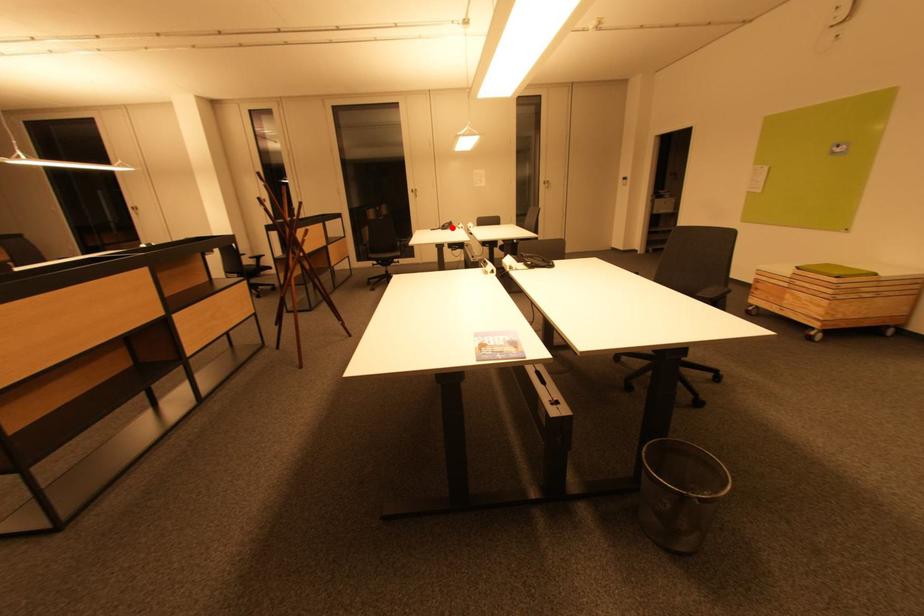
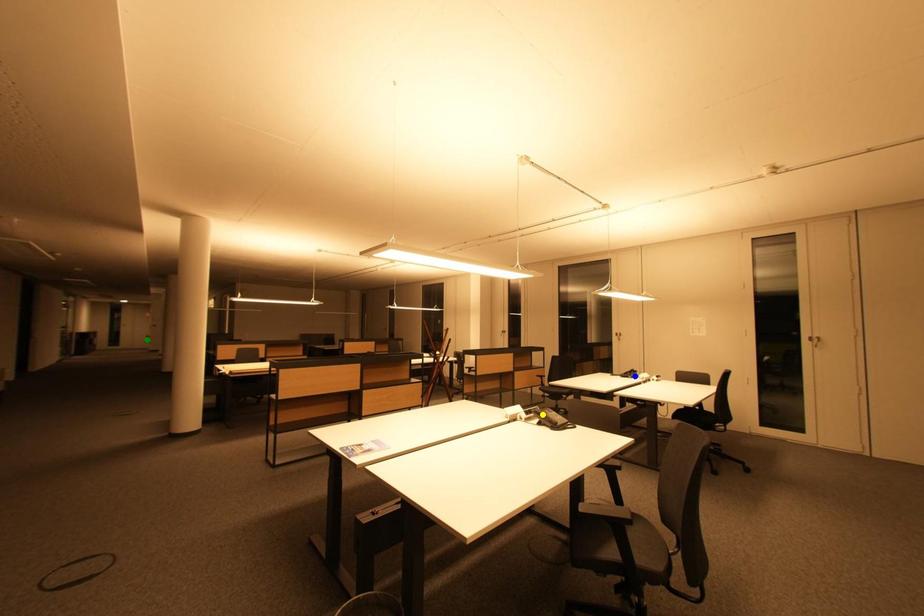
Question: I am providing you with two images of the same scene from different viewpoints. A red point is marked on the first image. You are given multiple points on the second image. In image 2, which mark is for the same physical point as the one in image 1?

Choices:
 (A) green point
 (B) yellow point
 (C) blue point

Answer: (C)